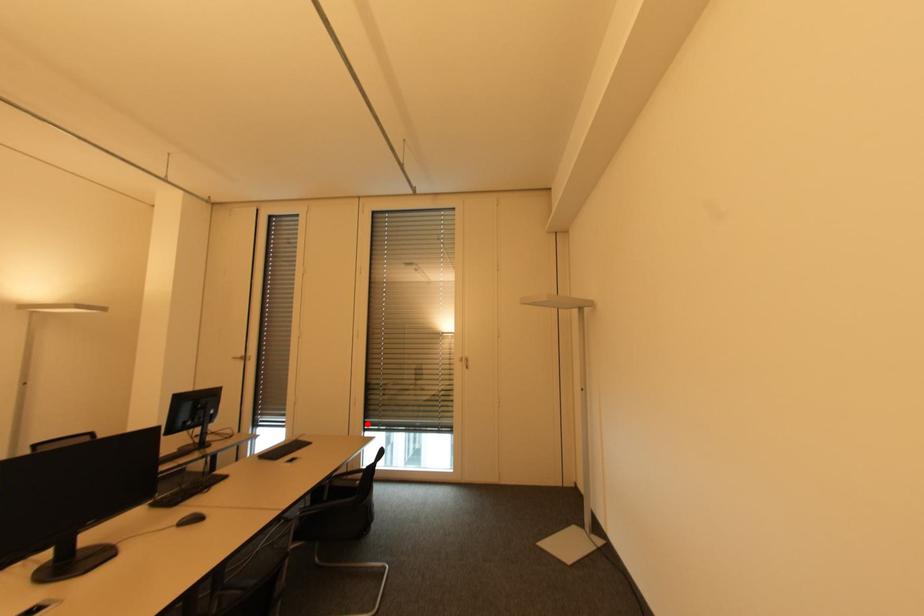
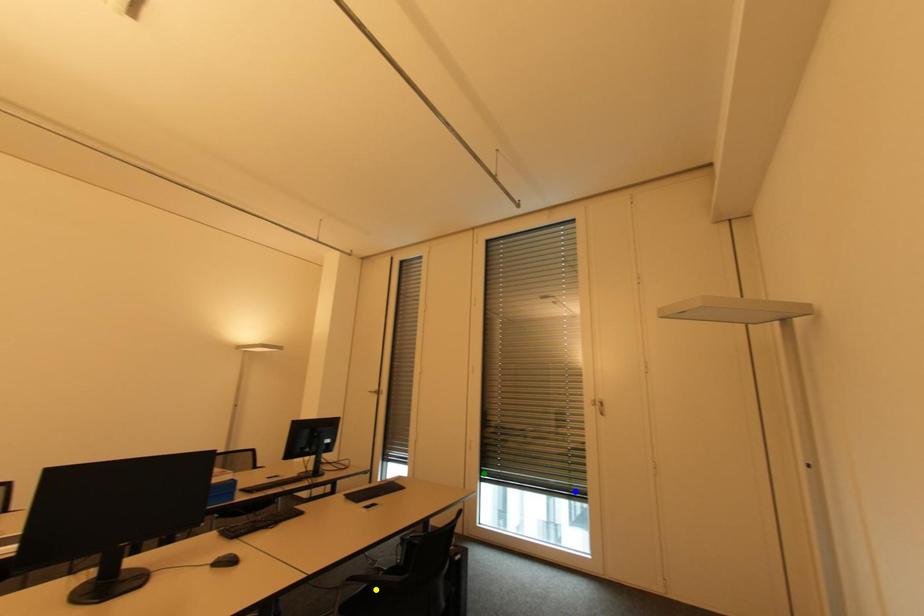
Question: I am providing you with two images of the same scene from different viewpoints. A red point is marked on the first image. You are given multiple points on the second image. Which mark in image 2 goes with the point in image 1?

Choices:
 (A) yellow point
 (B) green point
 (C) blue point

Answer: (B)